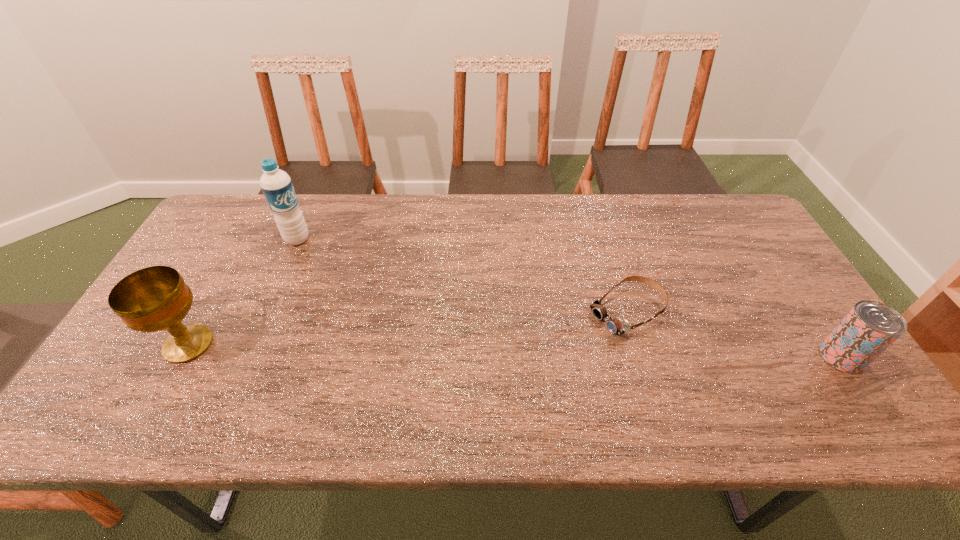
Find the location of a particular element. vacant space on the desktop that is between the leftmost object and the beer can and is positioned on the label of the water bottle is located at coordinates (424, 349).

Identify the location of free spot on the desktop that is between the second tallest object and the beer can and is positioned on the front-facing side of the shortest object. (560, 351).